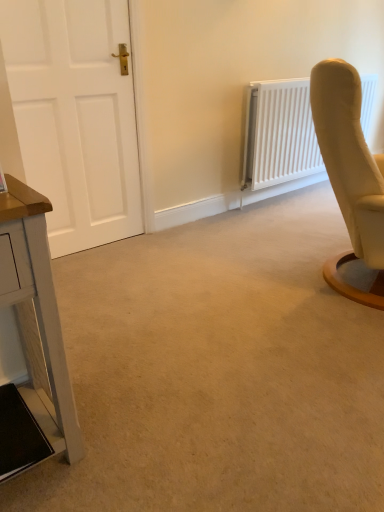
Question: Is white matte door at left taller than white painted wood table at left?

Choices:
 (A) yes
 (B) no

Answer: (A)

Question: Are white matte door at left and white painted wood table at left located far from each other?

Choices:
 (A) yes
 (B) no

Answer: (A)

Question: Does white matte door at left turn towards white painted wood table at left?

Choices:
 (A) yes
 (B) no

Answer: (B)

Question: Is white matte door at left directly adjacent to white painted wood table at left?

Choices:
 (A) yes
 (B) no

Answer: (B)

Question: Is the depth of white matte door at left less than that of white painted wood table at left?

Choices:
 (A) no
 (B) yes

Answer: (A)

Question: Is white matte door at left shorter than white painted wood table at left?

Choices:
 (A) no
 (B) yes

Answer: (A)

Question: Is white painted wood table at left to the right of white matte door at left from the viewer's perspective?

Choices:
 (A) yes
 (B) no

Answer: (A)

Question: From the image's perspective, does white painted wood table at left appear lower than white matte door at left?

Choices:
 (A) no
 (B) yes

Answer: (B)

Question: Is white painted wood table at left looking in the opposite direction of white matte door at left?

Choices:
 (A) no
 (B) yes

Answer: (A)

Question: Is white painted wood table at left beside white matte door at left?

Choices:
 (A) no
 (B) yes

Answer: (A)

Question: Considering the relative sizes of white painted wood table at left and white matte door at left in the image provided, is white painted wood table at left taller than white matte door at left?

Choices:
 (A) no
 (B) yes

Answer: (A)

Question: From a real-world perspective, does white painted wood table at left stand above white matte door at left?

Choices:
 (A) yes
 (B) no

Answer: (B)

Question: From the image's perspective, does white matte radiator at upper right appear lower than white matte door at left?

Choices:
 (A) yes
 (B) no

Answer: (B)